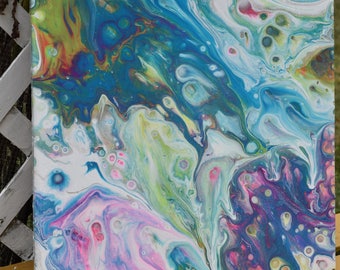
At what (x,y) coordinates should I click in order to perform the action: click on purple paint. Please return your answer as a coordinate pair (x, y). The height and width of the screenshot is (270, 340). Looking at the image, I should click on (275, 186).